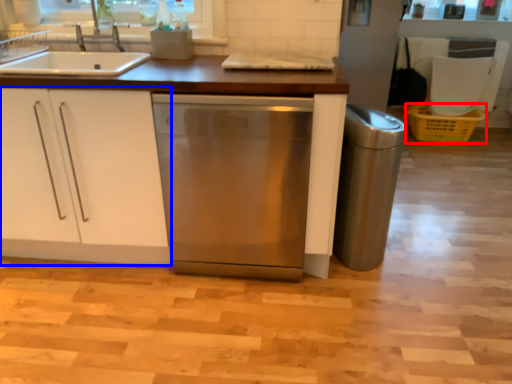
Question: Which object is closer to the camera taking this photo, crate (highlighted by a red box) or cabinetry (highlighted by a blue box)?

Choices:
 (A) crate
 (B) cabinetry

Answer: (B)